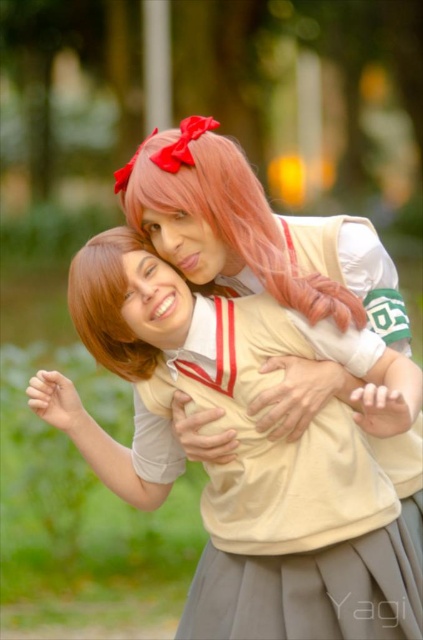
You are a photographer adjusting your camera settings to capture the scene. You notice the matte beige uniform at center and the pink silky wig at upper center. Which object should you focus on first to ensure the subject in the foreground is sharp?

The matte beige uniform at center should be focused on first because it is positioned under the pink silky wig at upper center, meaning it is closer to the camera and thus part of the foreground.